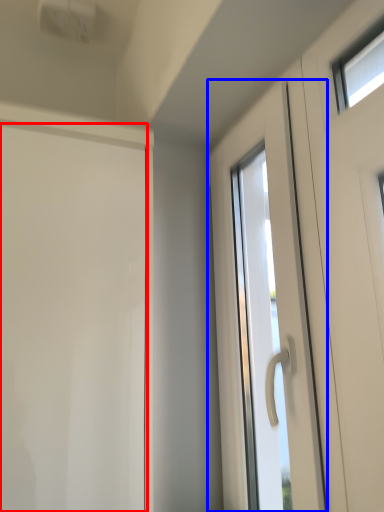
Question: Which point is further to the camera, door (highlighted by a red box) or door (highlighted by a blue box)?

Choices:
 (A) door
 (B) door

Answer: (B)